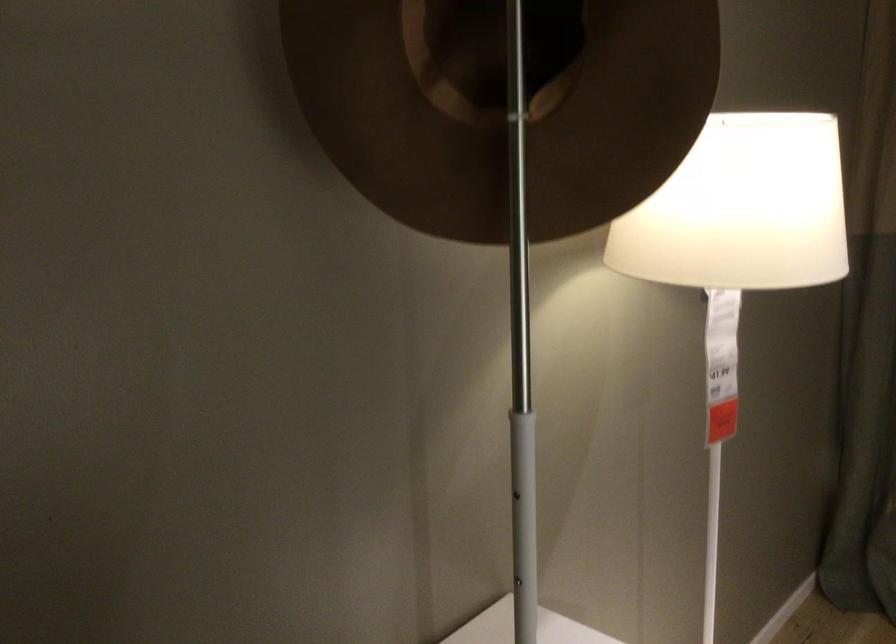
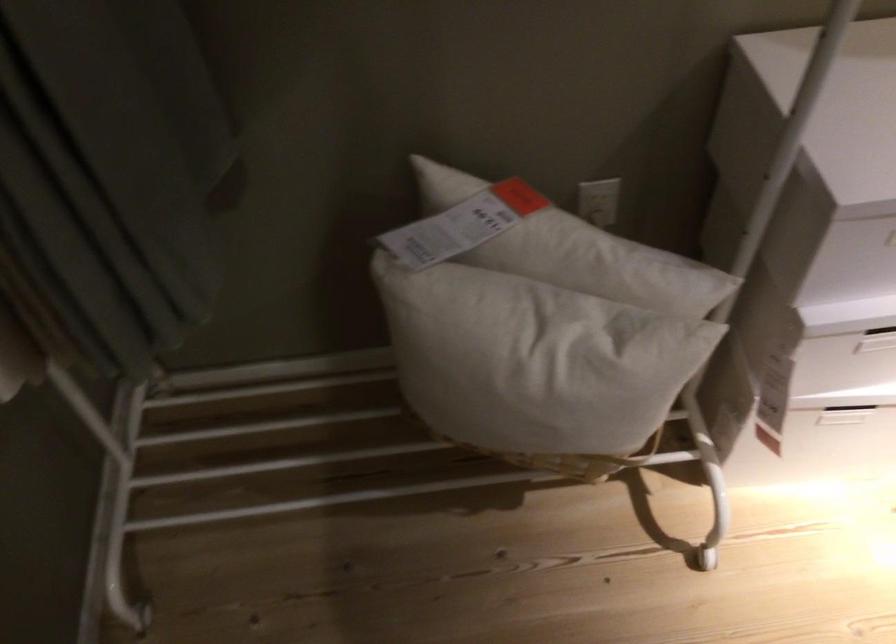
First-person continuous shooting, in which direction is the camera rotating?

The rotation direction of the camera is left-down.